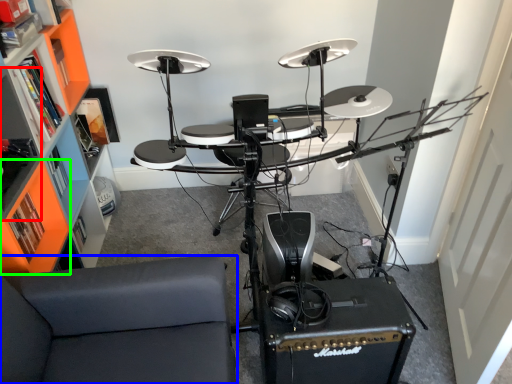
Question: Which object is the closest to the shelf (highlighted by a red box)? Choose among these: furniture (highlighted by a blue box) or shelf (highlighted by a green box).

Choices:
 (A) furniture
 (B) shelf

Answer: (B)